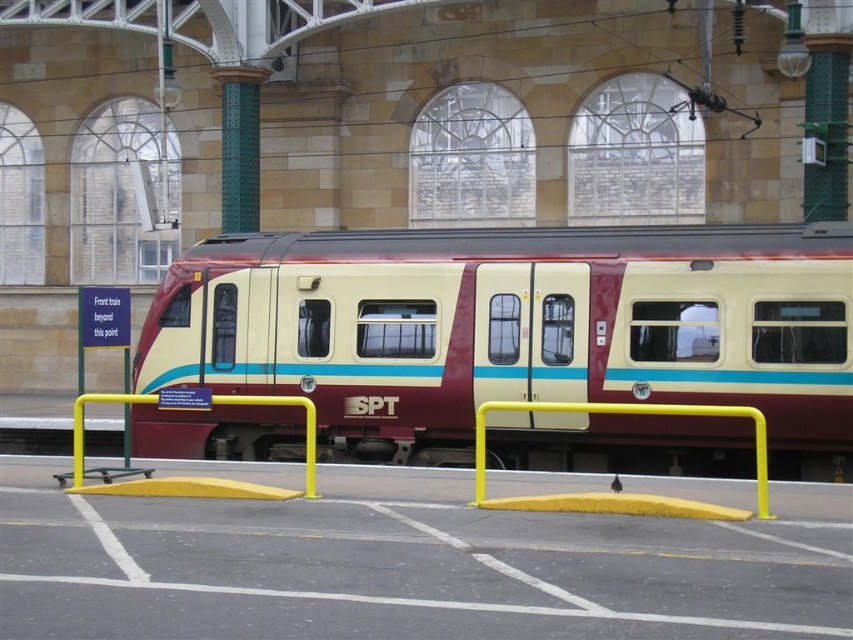
Is maroon matte train at center above yellow matte rail at center?

No, maroon matte train at center is not above yellow matte rail at center.

Does maroon matte train at center have a smaller size compared to yellow matte rail at center?

Correct, maroon matte train at center occupies less space than yellow matte rail at center.

Is point (512, 257) closer to viewer compared to point (756, 454)?

No.

Locate an element on the screen. maroon matte train at center is located at coordinates (515, 328).

Is yellow rubber curb at center taller than yellow matte rail at center?

No, yellow rubber curb at center is not taller than yellow matte rail at center.

Which of these two, yellow rubber curb at center or yellow matte rail at center, stands shorter?

yellow rubber curb at center

Who is more forward, (846, 520) or (657, 406)?

Positioned in front is point (846, 520).

Locate an element on the screen. yellow rubber curb at center is located at coordinates (410, 564).

Who is positioned more to the left, maroon matte train at center or yellow rubber curb at center?

Positioned to the left is maroon matte train at center.

Is point (561, 339) positioned behind point (148, 520)?

Yes, point (561, 339) is farther from viewer.

This screenshot has height=640, width=853. Identify the location of maroon matte train at center. (515, 328).